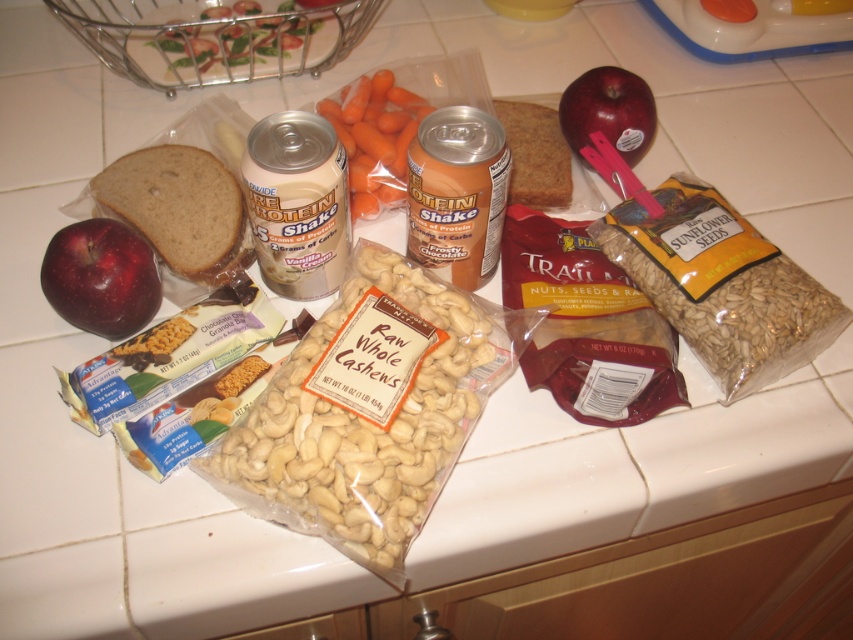
You are standing in the kitchen and see two points marked in the image. Which point is closer to you? The points are labeled as point (390, 81) and point (563, 163).

Point (563, 163) is closer to you because it is in front of point (390, 81).